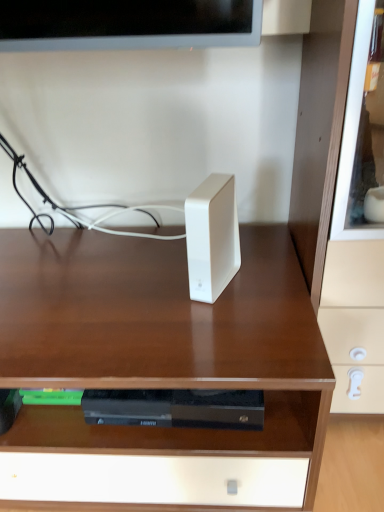
You are a GUI agent. You are given a task and a screenshot of the screen. Output one action in this format:
    pyautogui.click(x=<x>, y=<y>)
    Task: Click on the white matte ipod at center
    
    Given the screenshot: What is the action you would take?
    pyautogui.click(x=212, y=237)

Where is `matte white drawer at right`? The height and width of the screenshot is (512, 384). matte white drawer at right is located at coordinates (342, 197).

Looking at this image, considering the relative positions of white glossy speaker at center and white matte ipod at center in the image provided, is white glossy speaker at center to the right of white matte ipod at center from the viewer's perspective?

In fact, white glossy speaker at center is to the left of white matte ipod at center.

Is white glossy speaker at center oriented away from white matte ipod at center?

No, white glossy speaker at center is not facing the opposite direction of white matte ipod at center.

Does white glossy speaker at center have a smaller size compared to white matte ipod at center?

Actually, white glossy speaker at center might be larger than white matte ipod at center.

Are white glossy speaker at center and white matte ipod at center located far from each other?

white glossy speaker at center is actually quite close to white matte ipod at center.

Can you confirm if matte white drawer at right is thinner than white glossy speaker at center?

Yes.

Is matte white drawer at right aimed at white glossy speaker at center?

No, matte white drawer at right is not facing towards white glossy speaker at center.

Is matte white drawer at right positioned far away from white glossy speaker at center?

No, matte white drawer at right is not far from white glossy speaker at center.

Is the position of matte white drawer at right more distant than that of white glossy speaker at center?

No, matte white drawer at right is in front of white glossy speaker at center.

This screenshot has width=384, height=512. I want to click on ipod above the matte white drawer at right (from a real-world perspective), so click(x=212, y=237).

Is matte white drawer at right aimed at white matte ipod at center?

No.

Who is smaller, matte white drawer at right or white matte ipod at center?

white matte ipod at center is smaller.

Is white glossy speaker at center further to camera compared to matte white drawer at right?

Yes, it is behind matte white drawer at right.

Which of these two, white glossy speaker at center or matte white drawer at right, is bigger?

white glossy speaker at center is bigger.

From the image's perspective, is white glossy speaker at center positioned above or below matte white drawer at right?

white glossy speaker at center is below matte white drawer at right.

Considering the relative sizes of white glossy speaker at center and matte white drawer at right in the image provided, is white glossy speaker at center thinner than matte white drawer at right?

Incorrect, the width of white glossy speaker at center is not less than that of matte white drawer at right.

From a real-world perspective, who is located lower, white matte ipod at center or white glossy speaker at center?

In real-world perspective, white glossy speaker at center is lower.

Can white glossy speaker at center be found inside white matte ipod at center?

No, white glossy speaker at center is not surrounded by white matte ipod at center.

Between white matte ipod at center and white glossy speaker at center, which one has larger width?

Wider between the two is white glossy speaker at center.

Is white matte ipod at center further to camera compared to white glossy speaker at center?

Yes, the depth of white matte ipod at center is greater than that of white glossy speaker at center.

Which object is thinner, white matte ipod at center or matte white drawer at right?

With smaller width is white matte ipod at center.

Are white matte ipod at center and matte white drawer at right far apart?

No, white matte ipod at center is not far from matte white drawer at right.

From their relative heights in the image, would you say white matte ipod at center is taller or shorter than matte white drawer at right?

Considering their sizes, white matte ipod at center has less height than matte white drawer at right.

Which is in front, white matte ipod at center or matte white drawer at right?

Positioned in front is matte white drawer at right.

At what (x,y) coordinates should I click in order to perform the action: click on ipod above the white glossy speaker at center (from the image's perspective). Please return your answer as a coordinate pair (x, y). This screenshot has height=512, width=384. Looking at the image, I should click on (212, 237).

At what (x,y) coordinates should I click in order to perform the action: click on desk on the left of matte white drawer at right. Please return your answer as a coordinate pair (x, y). This screenshot has width=384, height=512. Looking at the image, I should click on (164, 357).

Based on their spatial positions, is matte white drawer at right or white glossy speaker at center further from white matte ipod at center?

matte white drawer at right.

Based on their spatial positions, is white glossy speaker at center or matte white drawer at right closer to white matte ipod at center?

Based on the image, white glossy speaker at center appears to be nearer to white matte ipod at center.

When comparing their distances from white glossy speaker at center, does matte white drawer at right or white matte ipod at center seem closer?

white matte ipod at center lies closer to white glossy speaker at center than the other object.

Looking at the image, which one is located closer to matte white drawer at right, white matte ipod at center or white glossy speaker at center?

white matte ipod at center lies closer to matte white drawer at right than the other object.

In the scene shown: From the image, which object appears to be farther from matte white drawer at right, white glossy speaker at center or white matte ipod at center?

Among the two, white glossy speaker at center is located further to matte white drawer at right.

Considering their positions, is white matte ipod at center positioned closer to white glossy speaker at center than matte white drawer at right?

Among the two, white matte ipod at center is located nearer to white glossy speaker at center.

Where is `ipod between white glossy speaker at center and matte white drawer at right from left to right`? ipod between white glossy speaker at center and matte white drawer at right from left to right is located at coordinates (212, 237).